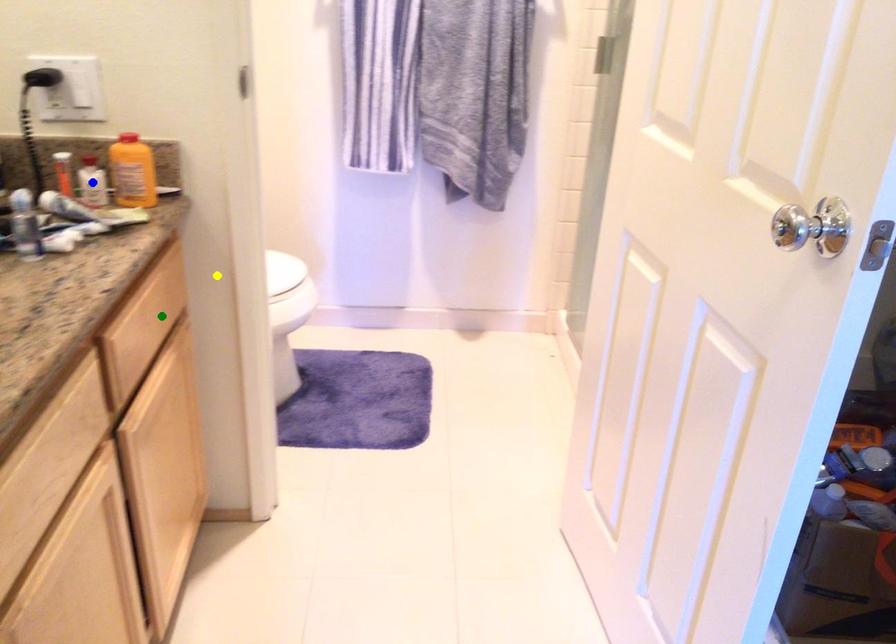
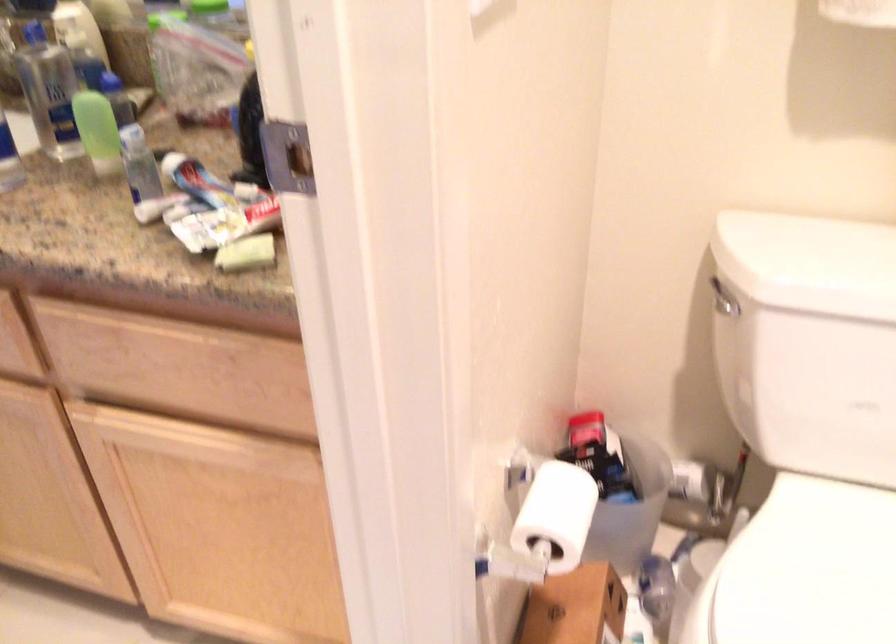
I am providing you with two images of the same scene from different viewpoints. Three points are marked in image1. Which point corresponds to a part or object that is occluded in image2?In image1, three points are marked. Which of them correspond to a part or object that is occluded in image2?Among the three points shown in image1, which one corresponds to a part or object that is no longer visible due to occlusion in image2?

blue point